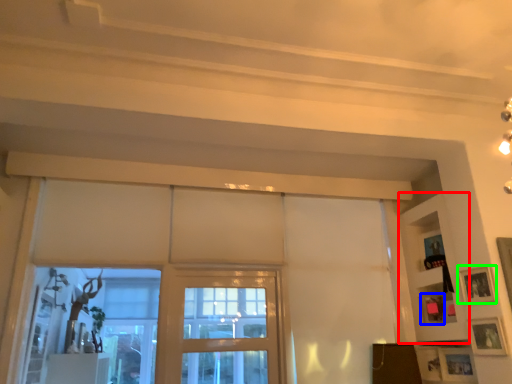
Question: Estimate the real-world distances between objects in this image. Which object is farther from shelf (highlighted by a red box), picture frame (highlighted by a blue box) or picture frame (highlighted by a green box)?

Choices:
 (A) picture frame
 (B) picture frame

Answer: (B)